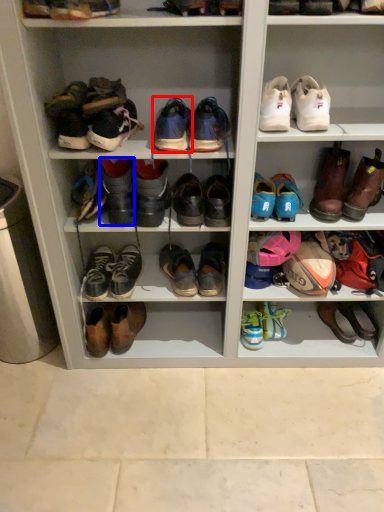
Question: Which object is closer to the camera taking this photo, footwear (highlighted by a red box) or footwear (highlighted by a blue box)?

Choices:
 (A) footwear
 (B) footwear

Answer: (A)